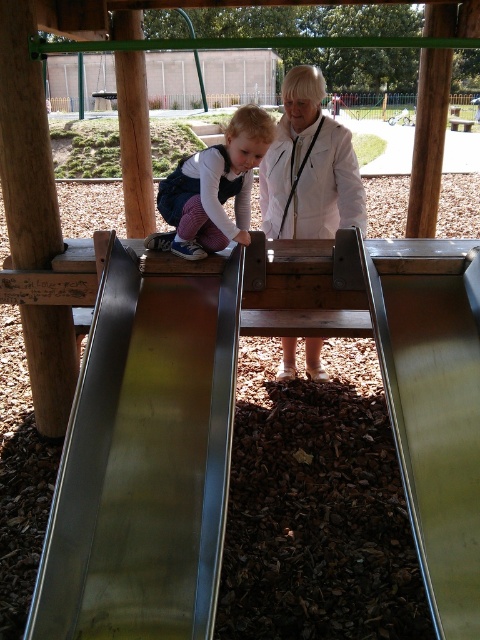
You are a parent trying to ensure safety at the playground. You notice the metallic smooth slide at upper left and the matte purple pants at center. Which object is wider, and does this affect the space needed for safe play?

The metallic smooth slide at upper left is wider than the matte purple pants at center. This means the slide requires more space for safe play compared to the pants.

You are a parent checking the playground for safety. You see the metallic smooth slide at upper left and the matte purple pants at center. Which object is taller?

The metallic smooth slide at upper left is taller than the matte purple pants at center.

You are a parent supervising children at the playground. You notice a child wearing a white matte jacket at center and matte purple pants at center. Which piece of clothing is higher on the child?

The white matte jacket at center is above the matte purple pants at center, so the white matte jacket at center is higher on the child.